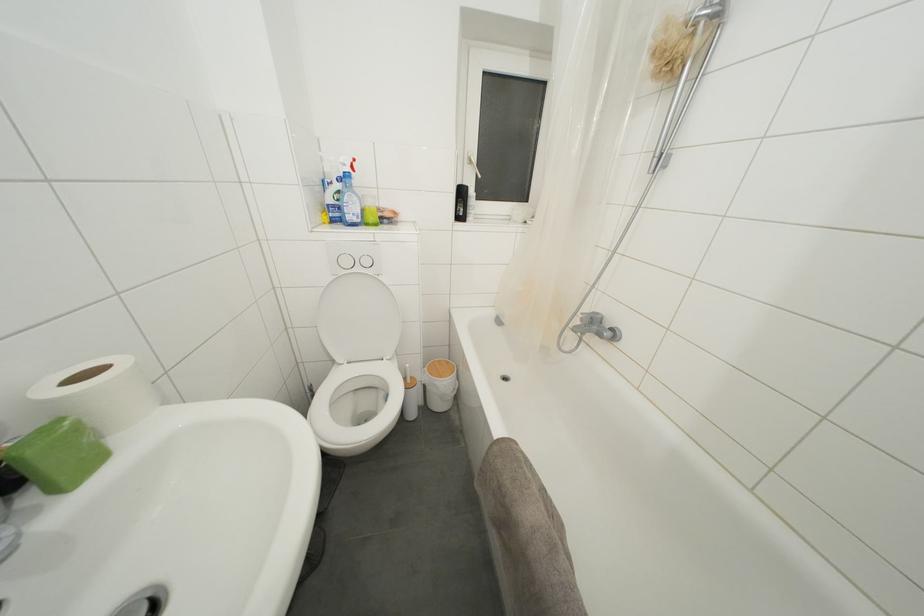
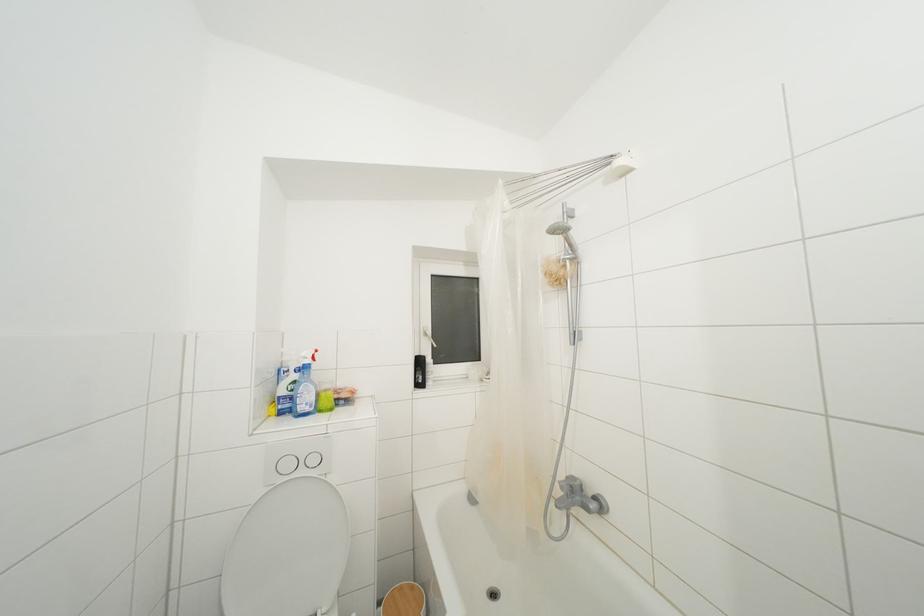
Question: How did the camera likely rotate?

Choices:
 (A) Left
 (B) Right
 (C) Up
 (D) Down

Answer: (C)